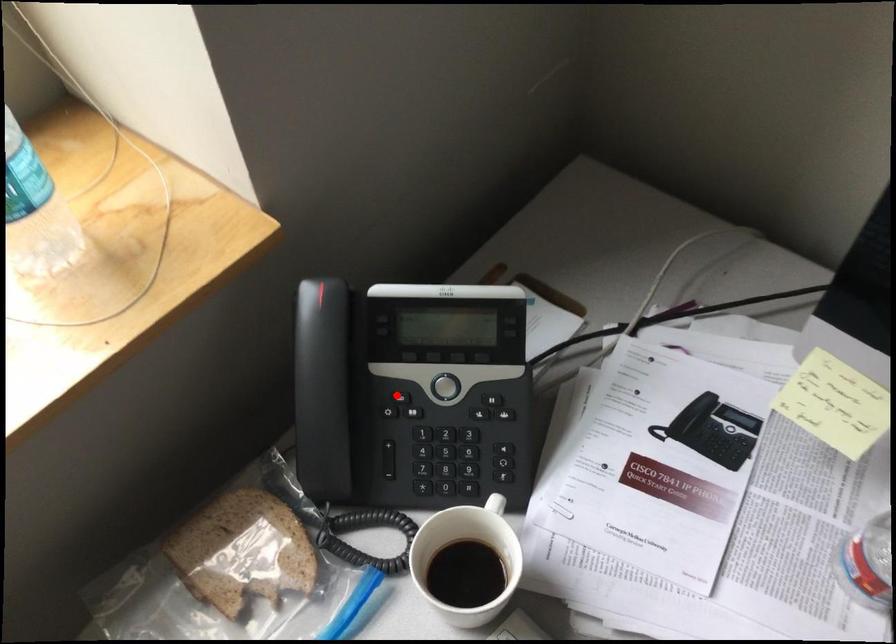
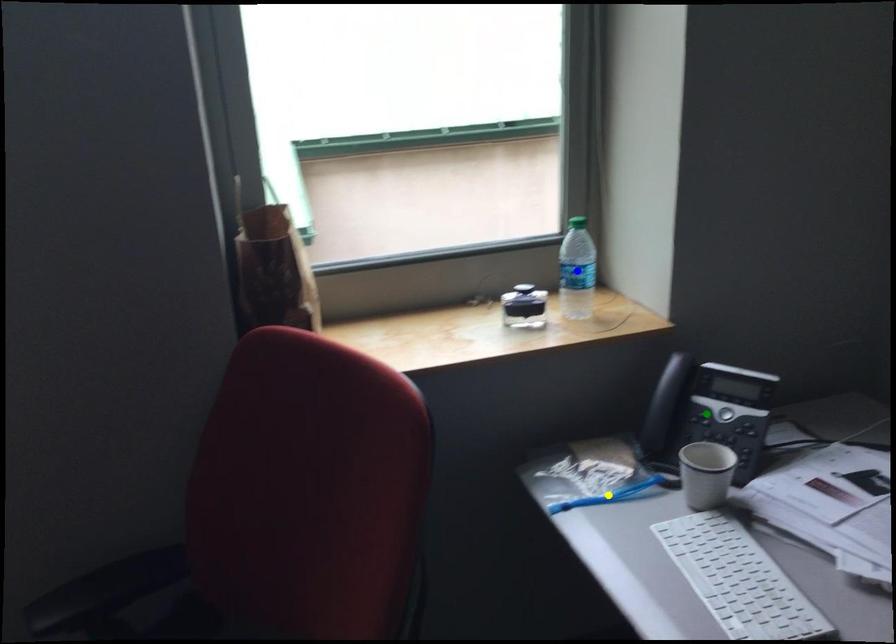
Question: I am providing you with two images of the same scene from different viewpoints. A red point is marked on the first image. You are given multiple points on the second image. Can you choose the point in image 2 that corresponds to the point in image 1?

Choices:
 (A) green point
 (B) yellow point
 (C) blue point

Answer: (A)